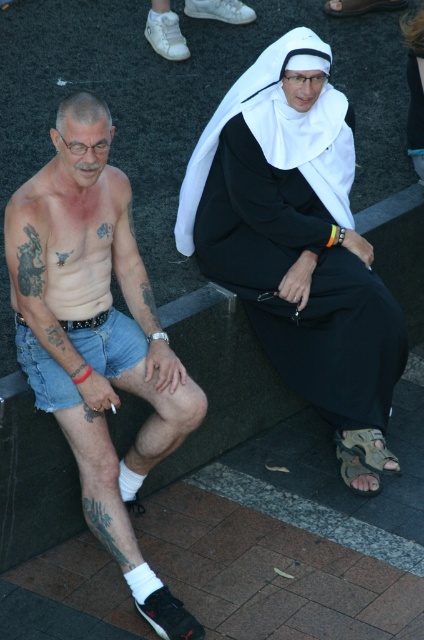
Question: Which object appears closest to the camera in this image?

Choices:
 (A) brown leather sandal at lower center
 (B) black tattooed skin at upper left
 (C) white matte nun's habit at upper center
 (D) black matte tattoo at lower left

Answer: (B)

Question: Which point is farther to the camera?

Choices:
 (A) denim shorts at left
 (B) denim shorts at lower left

Answer: (B)

Question: Is black matte tattoo at lower left positioned before black tattooed skin at upper left?

Choices:
 (A) yes
 (B) no

Answer: (B)

Question: Does black matte tattoo at lower left have a larger size compared to black tattooed skin at upper left?

Choices:
 (A) no
 (B) yes

Answer: (B)

Question: Which point is farther to the camera?

Choices:
 (A) (33, 262)
 (B) (301, 365)

Answer: (B)

Question: In this image, where is denim shorts at left located relative to black tattooed skin at upper left?

Choices:
 (A) above
 (B) below

Answer: (B)